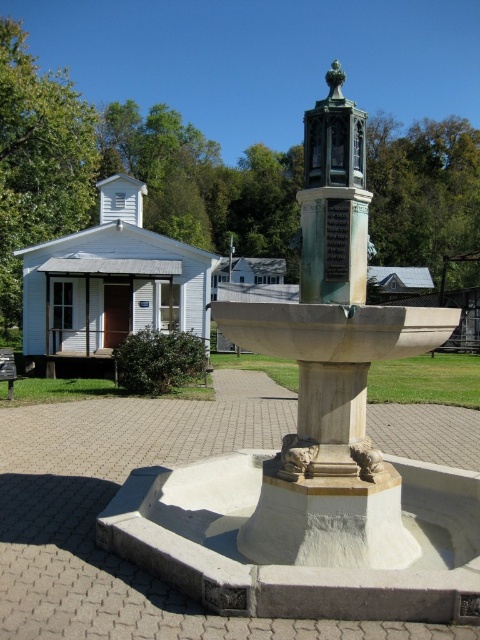
Which is above, white stone fountain at center or green patina metal bell tower at center?

green patina metal bell tower at center

The image size is (480, 640). I want to click on white stone fountain at center, so click(x=316, y=444).

Who is lower down, green patina metal bell tower at center or wooden park bench at lower left?

wooden park bench at lower left is lower down.

Who is taller, green patina metal bell tower at center or wooden park bench at lower left?

green patina metal bell tower at center is taller.

Does point (332, 230) come in front of point (10, 396)?

Yes, it is in front of point (10, 396).

The height and width of the screenshot is (640, 480). What are the coordinates of `green patina metal bell tower at center` in the screenshot? It's located at (334, 198).

Does white stone fountain at center have a larger size compared to wooden park bench at lower left?

Yes.

Is point (331, 118) closer to viewer compared to point (3, 380)?

Yes, it is.

The height and width of the screenshot is (640, 480). What are the coordinates of `white stone fountain at center` in the screenshot? It's located at (316, 444).